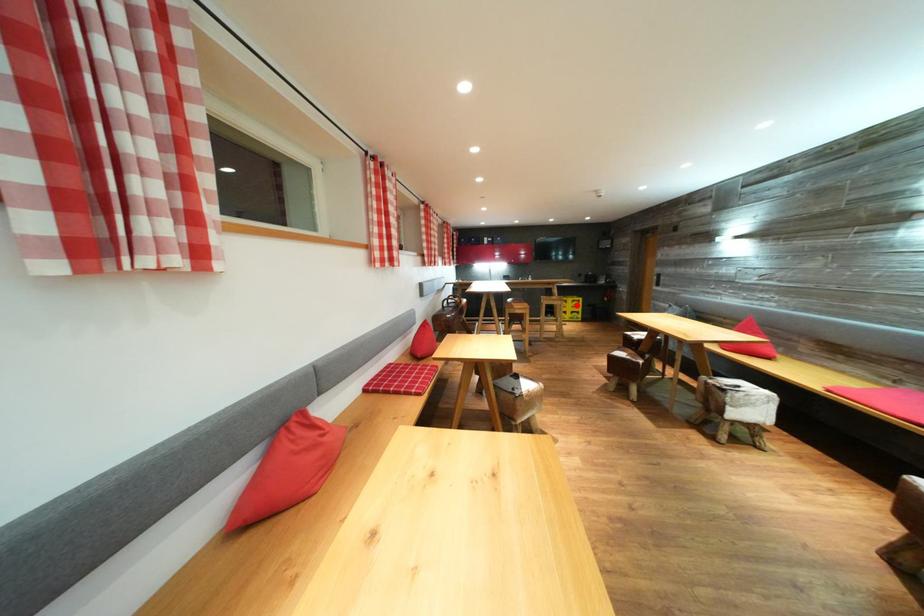
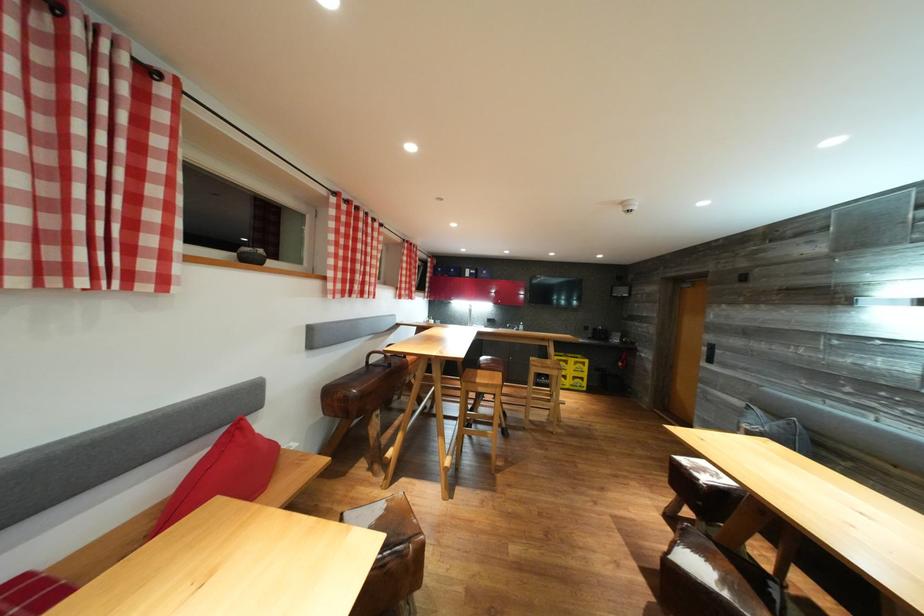
Question: I am providing you with two images of the same scene from different viewpoints. Image1 has a red point marked. In image2, the corresponding 3D location appears at what relative position? Reply with the corresponding letter.

Choices:
 (A) Closer
 (B) Farther

Answer: (B)